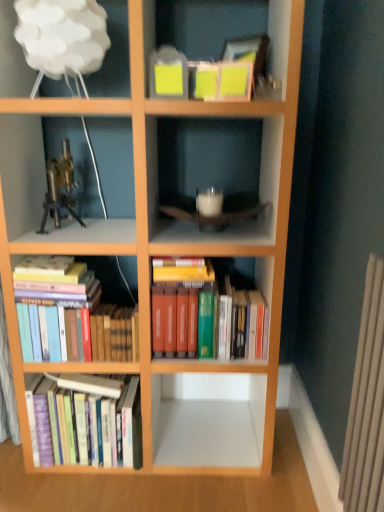
Question: From the image's perspective, does gold metallic microscope at upper left appear higher than white cloud lampshade at upper left?

Choices:
 (A) yes
 (B) no

Answer: (B)

Question: Does gold metallic microscope at upper left appear on the right side of white cloud lampshade at upper left?

Choices:
 (A) yes
 (B) no

Answer: (B)

Question: From a real-world perspective, is gold metallic microscope at upper left beneath white cloud lampshade at upper left?

Choices:
 (A) no
 (B) yes

Answer: (B)

Question: Is gold metallic microscope at upper left next to white cloud lampshade at upper left?

Choices:
 (A) no
 (B) yes

Answer: (A)

Question: Can you confirm if gold metallic microscope at upper left is positioned to the left of white cloud lampshade at upper left?

Choices:
 (A) yes
 (B) no

Answer: (A)

Question: From a real-world perspective, is hardcover books at lower left, which is the 1th book from left to right, physically located above or below hardcover books at center, marked as the 3th book in a left-to-right arrangement?

Choices:
 (A) above
 (B) below

Answer: (B)

Question: Considering their positions, is hardcover books at lower left, which is the 3th book in right-to-left order, located in front of or behind hardcover books at center, placed as the first book when sorted from right to left?

Choices:
 (A) front
 (B) behind

Answer: (B)

Question: In terms of width, does hardcover books at lower left, which is the 3th book in right-to-left order, look wider or thinner when compared to hardcover books at center, marked as the 3th book in a left-to-right arrangement?

Choices:
 (A) wide
 (B) thin

Answer: (B)

Question: In terms of height, does hardcover books at lower left, which is the 3th book in right-to-left order, look taller or shorter compared to hardcover books at center, marked as the 3th book in a left-to-right arrangement?

Choices:
 (A) short
 (B) tall

Answer: (B)

Question: From the image's perspective, relative to hardcover books at lower left, positioned as the 2th book in left-to-right order, is hardcover books at lower left, which is the 3th book in right-to-left order, above or below?

Choices:
 (A) above
 (B) below

Answer: (B)

Question: Is hardcover books at lower left, which is the 1th book from left to right, wider or thinner than hardcover books at lower left, positioned as the 2th book in left-to-right order?

Choices:
 (A) thin
 (B) wide

Answer: (B)

Question: From a real-world perspective, is hardcover books at lower left, which is the 1th book from left to right, positioned above or below hardcover books at lower left, positioned as the 2th book in left-to-right order?

Choices:
 (A) below
 (B) above

Answer: (A)

Question: Looking at the image, does hardcover books at lower left, which is the 1th book from left to right, seem bigger or smaller compared to hardcover books at lower left, which is counted as the second book, starting from the right?

Choices:
 (A) big
 (B) small

Answer: (A)

Question: Would you say hardcover books at lower left, positioned as the 2th book in left-to-right order, is to the left or to the right of gold metallic microscope at upper left in the picture?

Choices:
 (A) right
 (B) left

Answer: (A)

Question: Is hardcover books at lower left, positioned as the 2th book in left-to-right order, bigger or smaller than gold metallic microscope at upper left?

Choices:
 (A) big
 (B) small

Answer: (A)